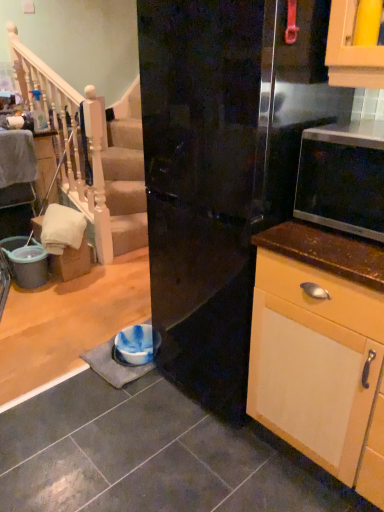
Question: Is glossy black refrigerator at center at the right side of white wood railing at upper left?

Choices:
 (A) no
 (B) yes

Answer: (B)

Question: From the image's perspective, is glossy black refrigerator at center on white wood railing at upper left?

Choices:
 (A) yes
 (B) no

Answer: (B)

Question: Could white wood railing at upper left be considered to be inside glossy black refrigerator at center?

Choices:
 (A) no
 (B) yes

Answer: (A)

Question: Does glossy black refrigerator at center have a lesser width compared to white wood railing at upper left?

Choices:
 (A) yes
 (B) no

Answer: (B)

Question: Does glossy black refrigerator at center lie behind white wood railing at upper left?

Choices:
 (A) no
 (B) yes

Answer: (A)

Question: From a real-world perspective, is glossy black refrigerator at center above or below matte black microwave at right?

Choices:
 (A) below
 (B) above

Answer: (A)

Question: From the image's perspective, relative to matte black microwave at right, is glossy black refrigerator at center above or below?

Choices:
 (A) below
 (B) above

Answer: (A)

Question: Is glossy black refrigerator at center inside or outside of matte black microwave at right?

Choices:
 (A) inside
 (B) outside

Answer: (B)

Question: Based on their positions, is glossy black refrigerator at center located to the left or right of matte black microwave at right?

Choices:
 (A) right
 (B) left

Answer: (B)

Question: Looking at the image, does matte black microwave at right seem bigger or smaller compared to white wood railing at upper left?

Choices:
 (A) small
 (B) big

Answer: (A)

Question: From the image's perspective, is matte black microwave at right located above or below white wood railing at upper left?

Choices:
 (A) above
 (B) below

Answer: (B)

Question: In terms of width, does matte black microwave at right look wider or thinner when compared to white wood railing at upper left?

Choices:
 (A) thin
 (B) wide

Answer: (B)

Question: Is matte black microwave at right inside or outside of white wood railing at upper left?

Choices:
 (A) inside
 (B) outside

Answer: (B)

Question: Is matte black microwave at right wider or thinner than glossy black refrigerator at center?

Choices:
 (A) wide
 (B) thin

Answer: (B)

Question: Is point (329, 202) positioned closer to the camera than point (256, 61)?

Choices:
 (A) closer
 (B) farther

Answer: (B)